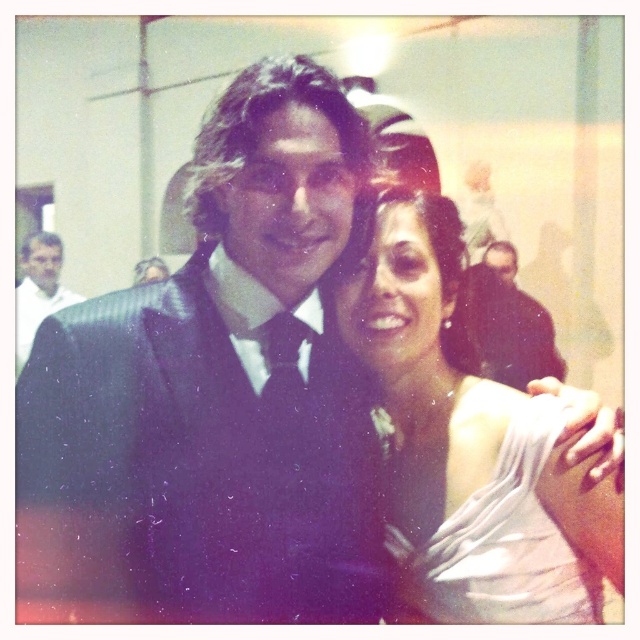
You are a photographer at a wedding reception and need to capture a closeup shot of the couple. The man is wearing a dark suit with a bow tie, and the woman is in a light satin white dress at center. Given that they are currently 87.47 centimeters apart, what is the minimum distance you should set your camera lens to ensure both subjects are in focus without moving them?

The minimum distance required for both subjects to be in focus would be at least 87.47 centimeters, ensuring the camera can capture both the man in the dark suit and the woman in the satin white dress at center clearly without needing to adjust their positions.

You are a photographer at a formal event. You need to position a light source to the right of the shiny black suit at left and to the left of the silky white dress at center. Is this possible based on their positions?

The silky white dress at center is to the right of the shiny black suit at left. Therefore, placing the light source to the right of the shiny black suit at left and to the left of the silky white dress at center is not possible because the dress is already positioned to the right of the suit, leaving no space between them for the light source.

You are standing in front of the image and want to touch the two points mentioned. Which point do you need to reach out to first, point (445,600) or point (16,362)?

Point (445,600) is closer to the viewer than point (16,362), so you should reach out to point (445,600) first.